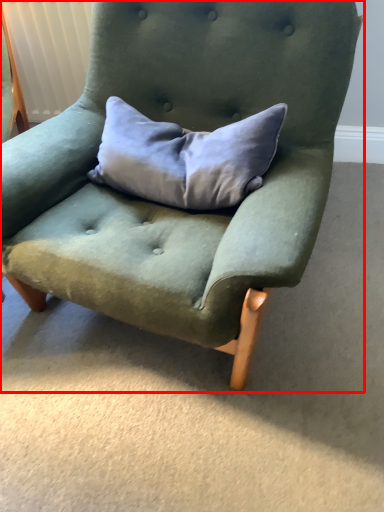
Question: In this image, where is chair (annotated by the red box) located relative to pillow?

Choices:
 (A) right
 (B) left

Answer: (B)